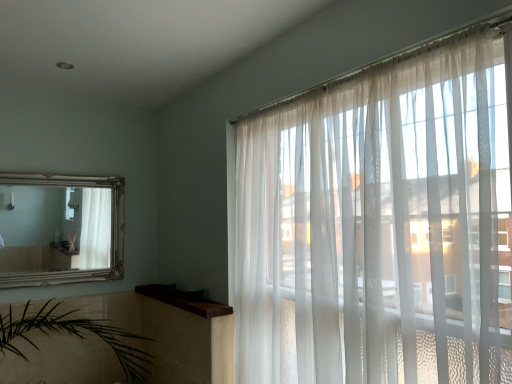
Question: From their relative heights in the image, would you say silver/gilded mirror at upper left is taller or shorter than translucent white curtains at right?

Choices:
 (A) tall
 (B) short

Answer: (B)

Question: Relative to translucent white curtains at right, is silver/gilded mirror at upper left in front or behind?

Choices:
 (A) front
 (B) behind

Answer: (B)

Question: Which of these objects is positioned closest to the translucent white curtains at right?

Choices:
 (A) brown wood at upper left
 (B) silver/gilded mirror at upper left

Answer: (A)

Question: Which object is positioned closest to the translucent white curtains at right?

Choices:
 (A) silver/gilded mirror at upper left
 (B) brown wood at upper left

Answer: (B)